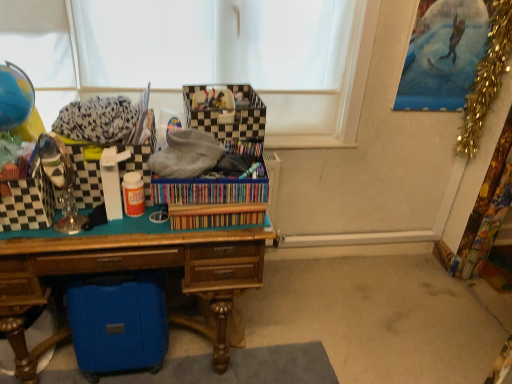
Question: Is the surface of gold tinsel garland at upper right in direct contact with blue fabric suitcase at lower left, positioned as the 4th storage box in top-to-bottom order?

Choices:
 (A) yes
 (B) no

Answer: (B)

Question: Is gold tinsel garland at upper right positioned with its back to blue fabric suitcase at lower left, positioned as the 4th storage box in top-to-bottom order?

Choices:
 (A) yes
 (B) no

Answer: (B)

Question: Can you confirm if gold tinsel garland at upper right is smaller than blue fabric suitcase at lower left, positioned as the 4th storage box in top-to-bottom order?

Choices:
 (A) no
 (B) yes

Answer: (B)

Question: Does gold tinsel garland at upper right have a lesser height compared to blue fabric suitcase at lower left, the first storage box positioned from the bottom?

Choices:
 (A) yes
 (B) no

Answer: (B)

Question: Does gold tinsel garland at upper right have a lesser width compared to blue fabric suitcase at lower left, the first storage box positioned from the bottom?

Choices:
 (A) no
 (B) yes

Answer: (B)

Question: In terms of height, does checkered fabric storage box at center, which appears as the first storage box when viewed from the top, look taller or shorter compared to checkered plastic storage box at left, which is the 3th storage box from top to bottom?

Choices:
 (A) short
 (B) tall

Answer: (A)

Question: Choose the correct answer: Is checkered fabric storage box at center, acting as the fourth storage box starting from the bottom, inside checkered plastic storage box at left, the 2th storage box in the bottom-to-top sequence, or outside it?

Choices:
 (A) inside
 (B) outside

Answer: (B)

Question: Is point (224, 132) closer or farther from the camera than point (47, 210)?

Choices:
 (A) closer
 (B) farther

Answer: (B)

Question: Is checkered fabric storage box at center, acting as the fourth storage box starting from the bottom, bigger or smaller than checkered plastic storage box at left, which is the 3th storage box from top to bottom?

Choices:
 (A) big
 (B) small

Answer: (A)

Question: In terms of size, does gold tinsel garland at upper right appear bigger or smaller than wooden desk at center?

Choices:
 (A) small
 (B) big

Answer: (A)

Question: Looking at their shapes, would you say gold tinsel garland at upper right is wider or thinner than wooden desk at center?

Choices:
 (A) wide
 (B) thin

Answer: (B)

Question: Relative to wooden desk at center, is gold tinsel garland at upper right in front or behind?

Choices:
 (A) behind
 (B) front

Answer: (A)

Question: From the image's perspective, is gold tinsel garland at upper right located above or below wooden desk at center?

Choices:
 (A) above
 (B) below

Answer: (A)

Question: Considering the positions of point (483, 86) and point (248, 139), is point (483, 86) closer or farther from the camera than point (248, 139)?

Choices:
 (A) farther
 (B) closer

Answer: (A)

Question: Considering the relative positions of gold tinsel garland at upper right and checkered fabric storage box at center, which appears as the first storage box when viewed from the top, in the image provided, is gold tinsel garland at upper right to the left or to the right of checkered fabric storage box at center, which appears as the first storage box when viewed from the top,?

Choices:
 (A) right
 (B) left

Answer: (A)